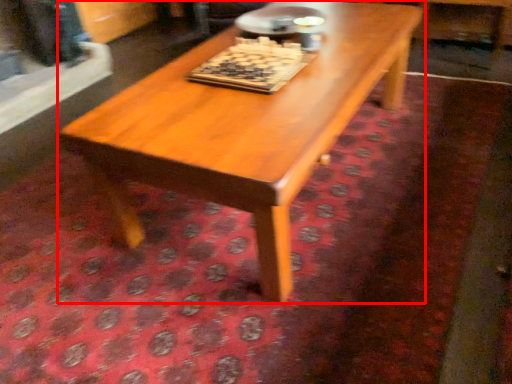
Question: Observing the image, what is the correct spatial positioning of coffee table (annotated by the red box) in reference to board game?

Choices:
 (A) right
 (B) left

Answer: (A)